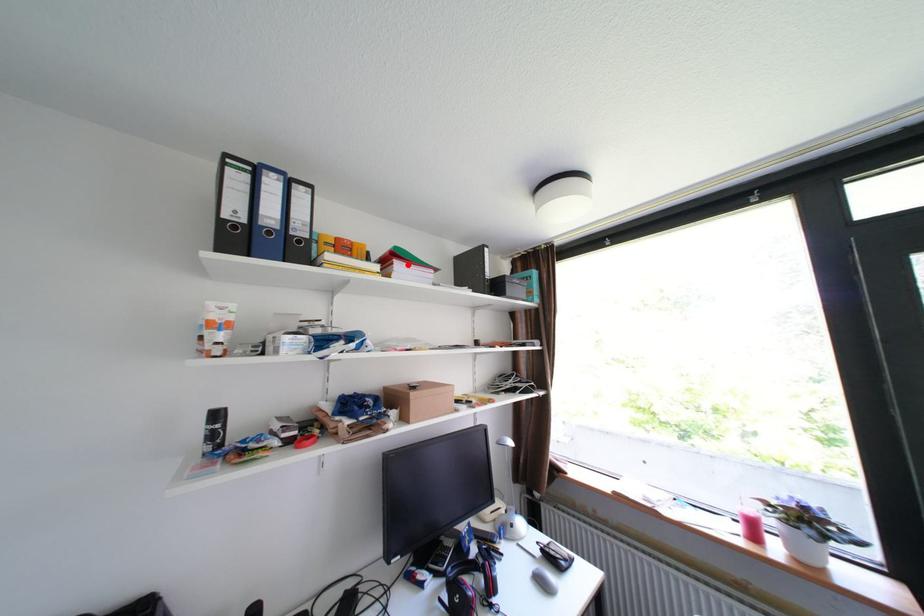
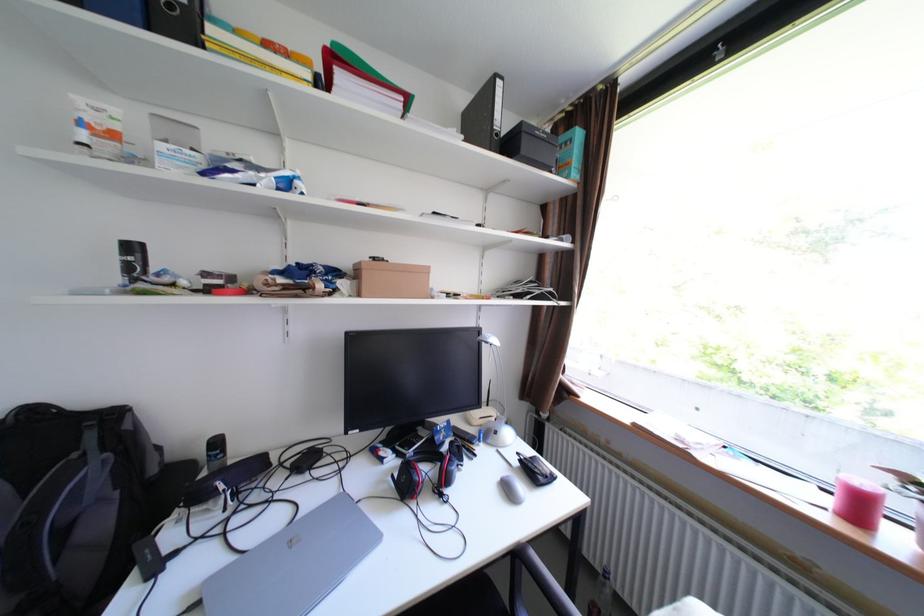
Locate, in the second image, the point that corresponds to the highlighted location in the first image.

(351, 76)